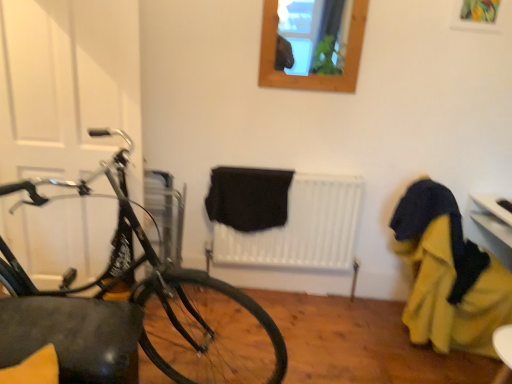
Question: Can you confirm if black matte radiator at center is taller than white matte door at left?

Choices:
 (A) yes
 (B) no

Answer: (B)

Question: Does black matte radiator at center turn towards white matte door at left?

Choices:
 (A) yes
 (B) no

Answer: (B)

Question: Does black matte radiator at center have a lesser height compared to white matte door at left?

Choices:
 (A) yes
 (B) no

Answer: (A)

Question: Is black matte radiator at center facing away from white matte door at left?

Choices:
 (A) yes
 (B) no

Answer: (B)

Question: Is white matte door at left located within black matte radiator at center?

Choices:
 (A) yes
 (B) no

Answer: (B)

Question: Does black matte radiator at center have a smaller size compared to white matte door at left?

Choices:
 (A) no
 (B) yes

Answer: (B)

Question: Does black matte radiator at center have a lesser height compared to yellow fabric at right?

Choices:
 (A) yes
 (B) no

Answer: (A)

Question: From the image's perspective, is black matte radiator at center located above yellow fabric at right?

Choices:
 (A) no
 (B) yes

Answer: (B)

Question: Can you confirm if black matte radiator at center is positioned to the right of yellow fabric at right?

Choices:
 (A) yes
 (B) no

Answer: (B)

Question: Does black matte radiator at center have a larger size compared to yellow fabric at right?

Choices:
 (A) no
 (B) yes

Answer: (A)

Question: Considering the relative positions of black matte radiator at center and yellow fabric at right in the image provided, is black matte radiator at center behind yellow fabric at right?

Choices:
 (A) no
 (B) yes

Answer: (B)

Question: Is black matte radiator at center positioned in front of yellow fabric at right?

Choices:
 (A) yes
 (B) no

Answer: (B)

Question: Is black matte radiator at center to the right of wooden frame at upper center from the viewer's perspective?

Choices:
 (A) no
 (B) yes

Answer: (A)